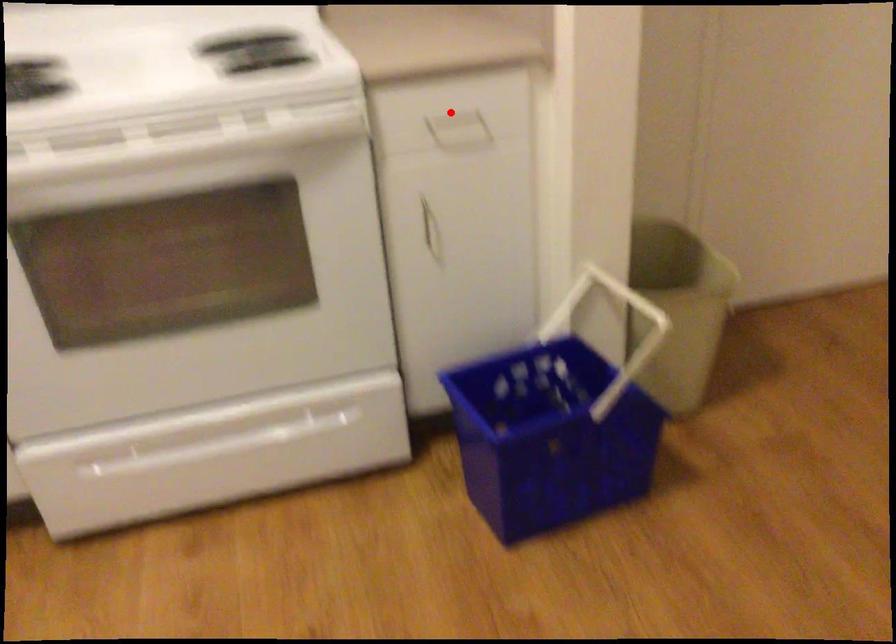
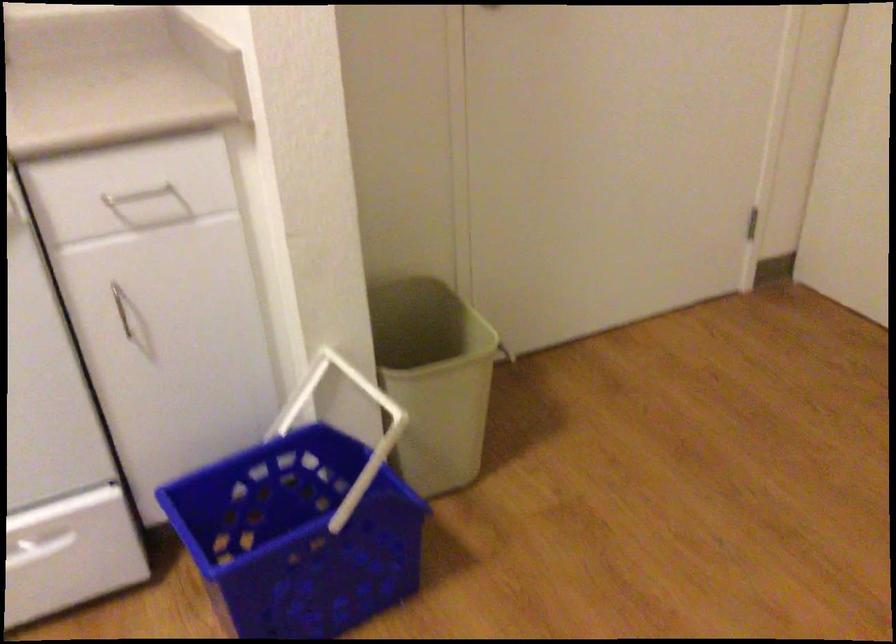
Find the pixel in the second image that matches the highlighted location in the first image.

(138, 194)